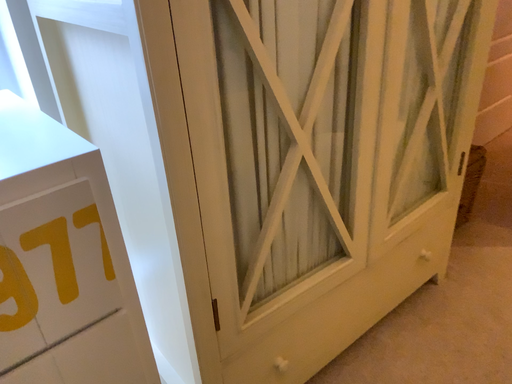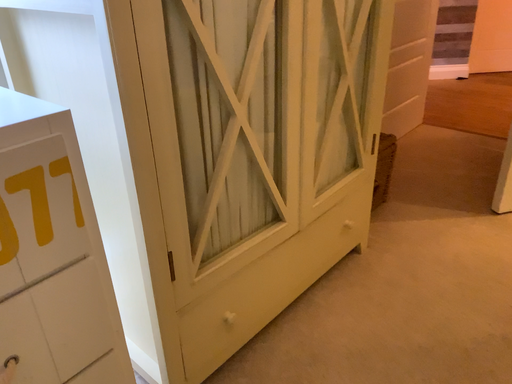
Question: How did the camera likely rotate when shooting the video?

Choices:
 (A) rotated right
 (B) rotated left

Answer: (A)